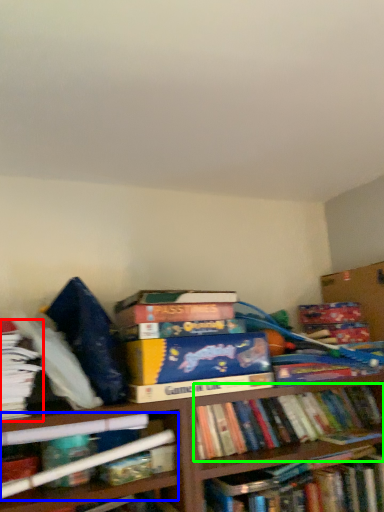
Question: Which object is the farthest from book (highlighted by a red box)? Choose among these: book (highlighted by a blue box) or book (highlighted by a green box).

Choices:
 (A) book
 (B) book

Answer: (B)